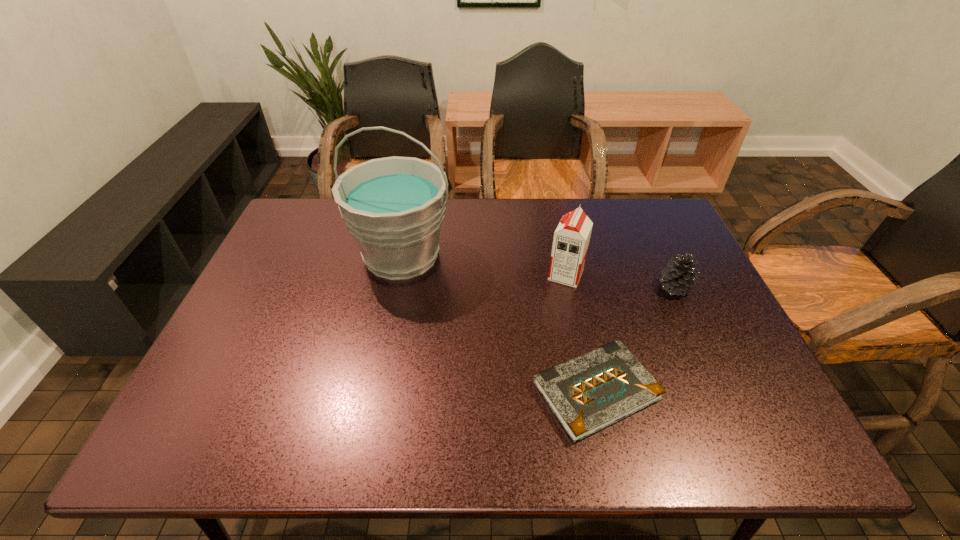
Identify the location of free spot between the tallest object and the second shortest object. (539, 272).

Locate an element on the screen. This screenshot has width=960, height=540. free space between the leftmost object and the nearest object is located at coordinates (499, 323).

Locate an element on the screen. empty space between the tallest object and the nearest object is located at coordinates [499, 323].

Where is `unoccupied position between the tallest object and the soya milk`? The width and height of the screenshot is (960, 540). unoccupied position between the tallest object and the soya milk is located at coordinates (484, 265).

The height and width of the screenshot is (540, 960). I want to click on unoccupied area between the rightmost object and the soya milk, so pyautogui.click(x=620, y=281).

Where is `vacant space in between the rightmost object and the second tallest object`? vacant space in between the rightmost object and the second tallest object is located at coordinates (620, 281).

Where is `vacant space in between the leftmost object and the shortest object`? The width and height of the screenshot is (960, 540). vacant space in between the leftmost object and the shortest object is located at coordinates (499, 323).

At what (x,y) coordinates should I click in order to perform the action: click on vacant region between the pinecone and the notebook. Please return your answer as a coordinate pair (x, y). The width and height of the screenshot is (960, 540). Looking at the image, I should click on (636, 339).

What are the coordinates of `free spot between the tallest object and the third shortest object` in the screenshot? It's located at (484, 265).

This screenshot has width=960, height=540. Find the location of `vacant space that's between the bucket and the nearest object`. vacant space that's between the bucket and the nearest object is located at coordinates coord(499,323).